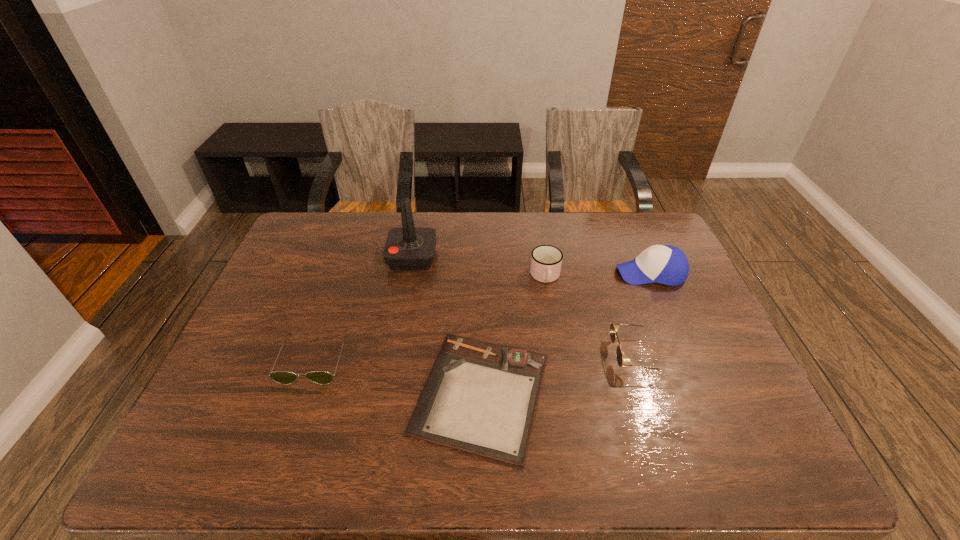
Locate an element on the screen. object located in the right edge section of the desktop is located at coordinates (665, 264).

In the image, there is a desktop. Identify the location of vacant space at the far edge. Image resolution: width=960 pixels, height=540 pixels. (563, 231).

This screenshot has height=540, width=960. I want to click on vacant space at the near edge, so click(x=559, y=471).

At what (x,y) coordinates should I click in order to perform the action: click on vacant space at the right edge. Please return your answer as a coordinate pair (x, y). Looking at the image, I should click on (749, 414).

The height and width of the screenshot is (540, 960). I want to click on free space at the far left corner of the desktop, so click(x=323, y=225).

Find the location of a particular element. The width and height of the screenshot is (960, 540). free spot at the near right corner of the desktop is located at coordinates click(x=747, y=456).

At what (x,y) coordinates should I click in order to perform the action: click on free spot between the leftmost object and the mug. Please return your answer as a coordinate pair (x, y). Image resolution: width=960 pixels, height=540 pixels. Looking at the image, I should click on (429, 318).

Locate an element on the screen. The height and width of the screenshot is (540, 960). vacant space that is in between the mug and the baseball cap is located at coordinates (598, 275).

This screenshot has height=540, width=960. What are the coordinates of `empty space that is in between the mug and the clipboard` in the screenshot? It's located at (513, 335).

You are a GUI agent. You are given a task and a screenshot of the screen. Output one action in this format:
    pyautogui.click(x=<x>, y=<y>)
    Task: Click on the vacant space that is in between the clipboard and the leftmost object
    
    Given the screenshot: What is the action you would take?
    pyautogui.click(x=397, y=376)